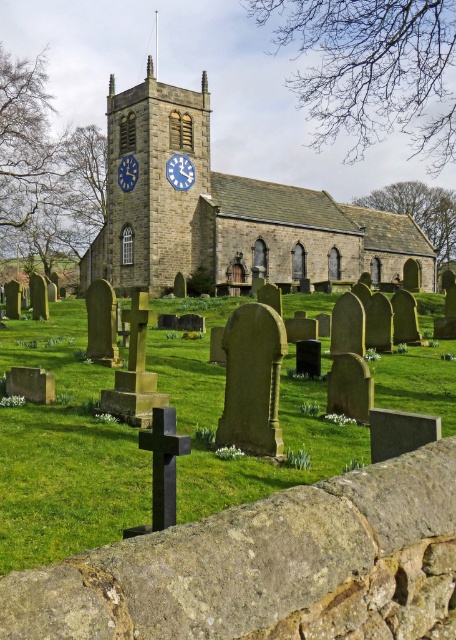
Between point (15, 413) and point (234, 218), which one is positioned behind?

The point (234, 218) is behind.

Who is positioned more to the left, green grass at center or stone clock tower at center?

green grass at center is more to the left.

Which is behind, point (47, 483) or point (250, 262)?

The point (250, 262) is more distant.

Locate an element on the screen. Image resolution: width=456 pixels, height=640 pixels. green grass at center is located at coordinates (65, 452).

Who is lower down, stone clock tower at center or blue painted wood clock at center?

stone clock tower at center is below.

Between stone clock tower at center and blue painted wood clock at center, which one appears on the left side from the viewer's perspective?

From the viewer's perspective, blue painted wood clock at center appears more on the left side.

You are a GUI agent. You are given a task and a screenshot of the screen. Output one action in this format:
    pyautogui.click(x=<x>, y=<y>)
    Task: Click on the stone clock tower at center
    The image size is (456, 640).
    Given the screenshot: What is the action you would take?
    pyautogui.click(x=224, y=211)

Can you confirm if green grass at center is wider than blue painted wood clock at center?

Yes.

Who is positioned more to the left, green grass at center or blue painted wood clock at center?

blue painted wood clock at center

Is point (346, 435) farther from viewer compared to point (176, 170)?

No, (346, 435) is in front of (176, 170).

The image size is (456, 640). Identify the location of green grass at center. (65, 452).